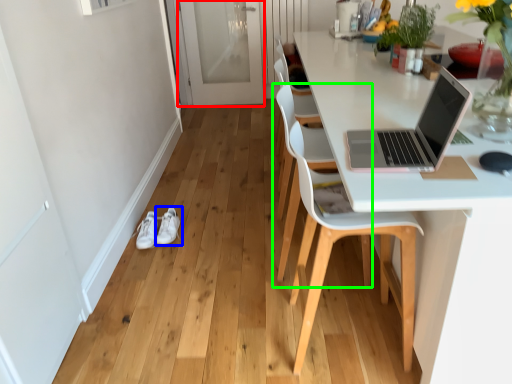
Question: Which object is the closest to the screen door (highlighted by a red box)? Choose among these: footwear (highlighted by a blue box) or chair (highlighted by a green box).

Choices:
 (A) footwear
 (B) chair

Answer: (A)